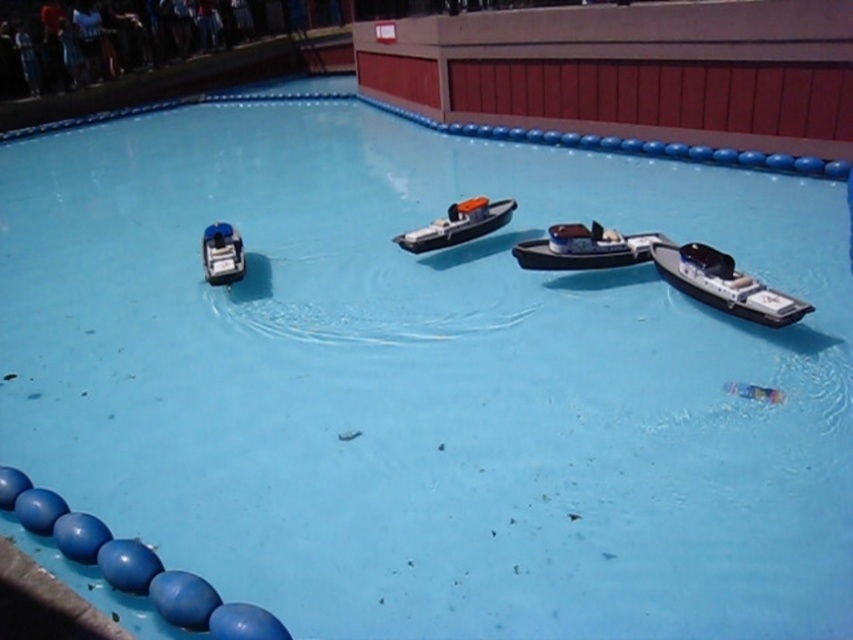
Question: Which point is farther to the camera?

Choices:
 (A) orange matte boat at center
 (B) shiny silver boat at center

Answer: (A)

Question: Which object appears farthest from the camera in this image?

Choices:
 (A) shiny blue toy boat at left
 (B) metallic silver boat at right

Answer: (A)

Question: From the image, what is the correct spatial relationship of metallic silver boat at right in relation to orange matte boat at center?

Choices:
 (A) below
 (B) above

Answer: (A)

Question: Which of the following is the farthest from the observer?

Choices:
 (A) shiny blue toy boat at left
 (B) shiny silver boat at center

Answer: (A)

Question: In this image, where is orange matte boat at center located relative to shiny blue toy boat at left?

Choices:
 (A) below
 (B) above

Answer: (B)

Question: Does metallic silver boat at right have a greater width compared to shiny blue toy boat at left?

Choices:
 (A) no
 (B) yes

Answer: (B)